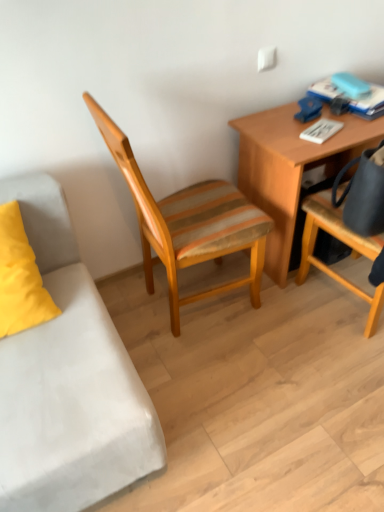
Question: Is woodenchair at center, which is the second chair in right-to-left order, looking in the opposite direction of wooden desk at upper right?

Choices:
 (A) no
 (B) yes

Answer: (A)

Question: Does woodenchair at center, which is the 1th chair from left to right, lie in front of wooden desk at upper right?

Choices:
 (A) no
 (B) yes

Answer: (B)

Question: Are woodenchair at center, which is the second chair in right-to-left order, and wooden desk at upper right making contact?

Choices:
 (A) yes
 (B) no

Answer: (B)

Question: From the image's perspective, is woodenchair at center, which is the second chair in right-to-left order, located beneath wooden desk at upper right?

Choices:
 (A) no
 (B) yes

Answer: (B)

Question: Can you confirm if woodenchair at center, which is the 1th chair from left to right, is wider than wooden desk at upper right?

Choices:
 (A) yes
 (B) no

Answer: (A)

Question: Does point (258, 147) appear closer or farther from the camera than point (369, 318)?

Choices:
 (A) closer
 (B) farther

Answer: (B)

Question: In terms of height, does wooden desk at upper right look taller or shorter compared to matte black bag at right, the 1th chair positioned from the right?

Choices:
 (A) tall
 (B) short

Answer: (B)

Question: Is wooden desk at upper right wider or thinner than matte black bag at right, the 1th chair positioned from the right?

Choices:
 (A) wide
 (B) thin

Answer: (B)

Question: Considering the positions of wooden desk at upper right and matte black bag at right, arranged as the second chair when viewed from the left, in the image, is wooden desk at upper right bigger or smaller than matte black bag at right, arranged as the second chair when viewed from the left,?

Choices:
 (A) small
 (B) big

Answer: (A)

Question: From a real-world perspective, relative to woodenchair at center, which is the second chair in right-to-left order, is matte black bag at right, arranged as the second chair when viewed from the left, vertically above or below?

Choices:
 (A) above
 (B) below

Answer: (B)

Question: Looking at the image, does matte black bag at right, arranged as the second chair when viewed from the left, seem bigger or smaller compared to woodenchair at center, which is the 1th chair from left to right?

Choices:
 (A) small
 (B) big

Answer: (A)

Question: Is matte black bag at right, the 1th chair positioned from the right, to the left or to the right of woodenchair at center, which is the second chair in right-to-left order, in the image?

Choices:
 (A) right
 (B) left

Answer: (A)

Question: Relative to woodenchair at center, which is the second chair in right-to-left order, is matte black bag at right, the 1th chair positioned from the right, in front or behind?

Choices:
 (A) behind
 (B) front

Answer: (B)

Question: From the image's perspective, is wooden desk at upper right above or below woodenchair at center, which is the 1th chair from left to right?

Choices:
 (A) below
 (B) above

Answer: (B)

Question: From a real-world perspective, is wooden desk at upper right physically located above or below woodenchair at center, which is the 1th chair from left to right?

Choices:
 (A) above
 (B) below

Answer: (B)